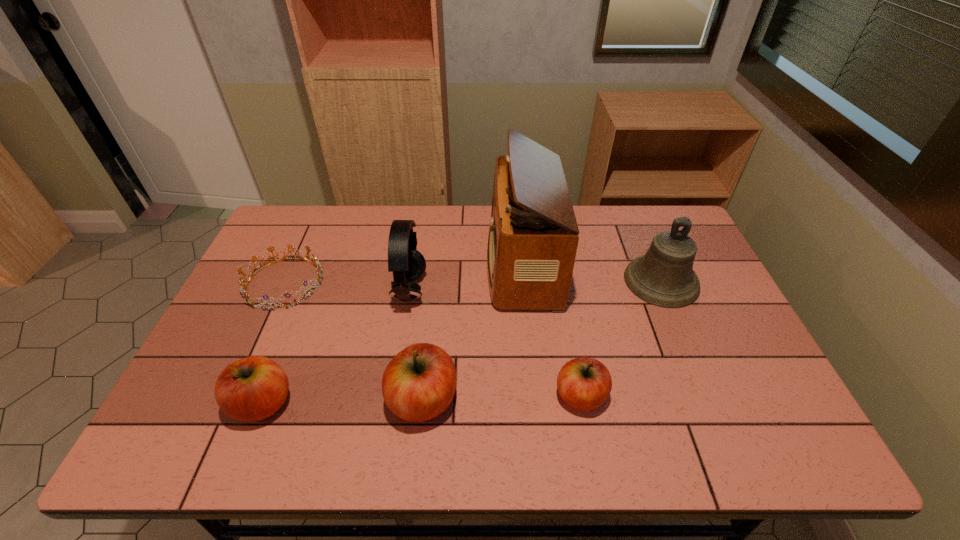
Find the location of `vacant space that satisfies the following two spatial constraints: 1. on the back side of the second apple from right to left; 2. on the front-facing side of the tiara`. vacant space that satisfies the following two spatial constraints: 1. on the back side of the second apple from right to left; 2. on the front-facing side of the tiara is located at coordinates (435, 283).

At what (x,y) coordinates should I click in order to perform the action: click on vacant area in the image that satisfies the following two spatial constraints: 1. on the ear cups of the earphone; 2. on the back side of the rightmost apple. Please return your answer as a coordinate pair (x, y). This screenshot has height=540, width=960. Looking at the image, I should click on (393, 396).